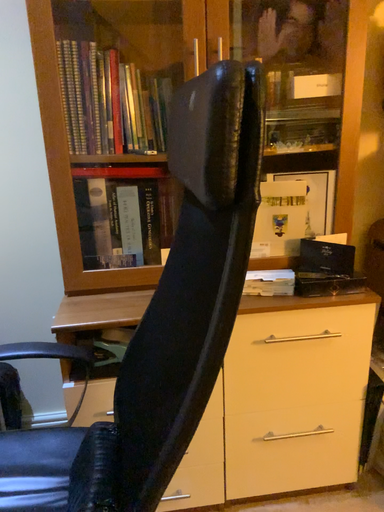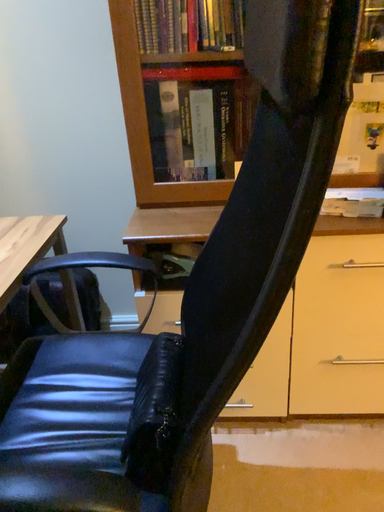
Question: How did the camera likely rotate when shooting the video?

Choices:
 (A) rotated left
 (B) rotated right

Answer: (A)